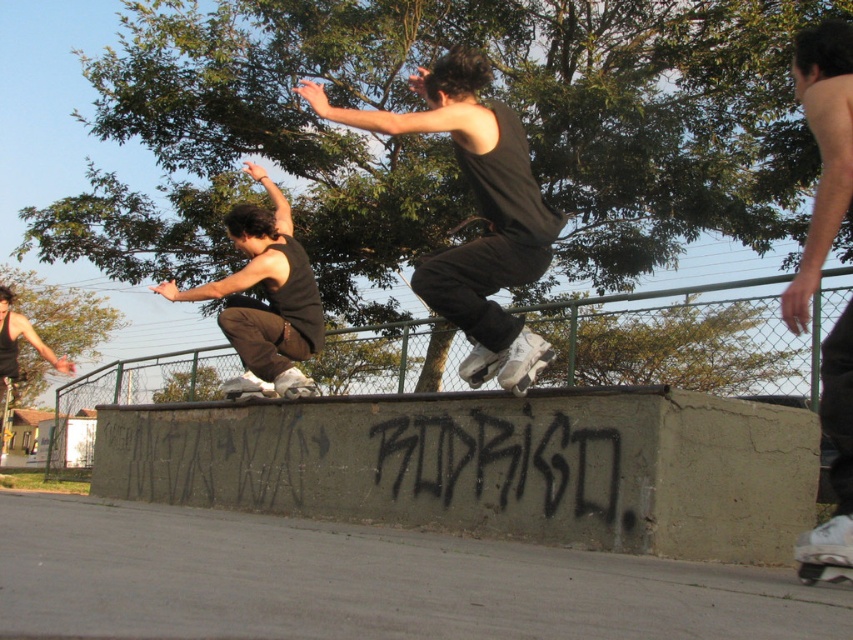
Looking at this image, you are a photographer at the skatepark and want to capture a photo where the black matte tank top at center and the matte black tank top at center are both visible. Which one will appear larger in the photo?

The black matte tank top at center will appear larger in the photo because it is taller than the matte black tank top at center.

You are a photographer at the skatepark and want to capture a photo of both the black matte tank top at center and the shiny black tank top at upper right in the same frame. Based on their positions, which direction should you move your camera to include both subjects?

To include both the black matte tank top at center and the shiny black tank top at upper right in the same frame, you should move your camera to the left since the black matte tank top at center is positioned to the left of the shiny black tank top at upper right.